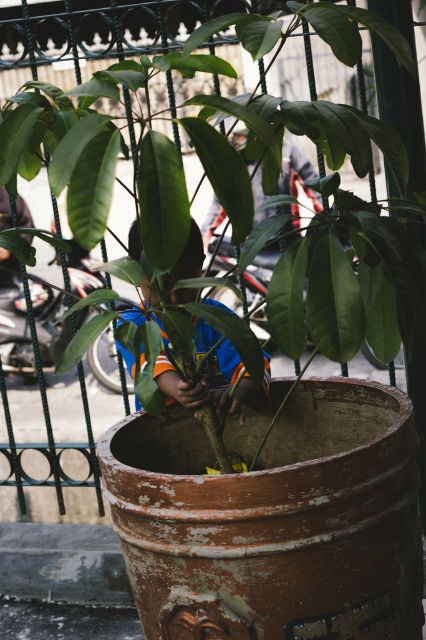
Question: Among these objects, which one is nearest to the camera?

Choices:
 (A) green matte pot at center
 (B) blue jersey at center

Answer: (A)

Question: Is green matte pot at center wider than blue jersey at center?

Choices:
 (A) no
 (B) yes

Answer: (B)

Question: Is the position of green matte pot at center more distant than that of blue jersey at center?

Choices:
 (A) no
 (B) yes

Answer: (A)

Question: Is the position of green matte pot at center more distant than that of blue jersey at center?

Choices:
 (A) no
 (B) yes

Answer: (A)